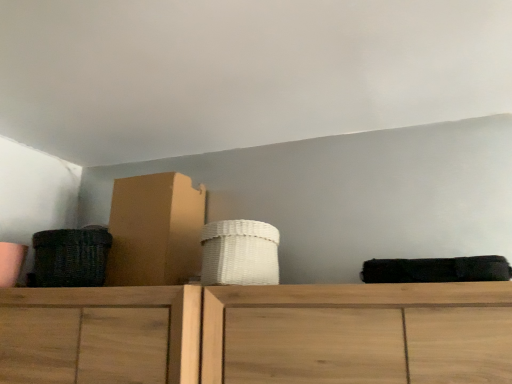
Question: Does white woven basket at center, which is counted as the 2th basket, starting from the left, turn towards dark brown woven basket at left, placed as the second basket when sorted from right to left?

Choices:
 (A) yes
 (B) no

Answer: (B)

Question: Is white woven basket at center, which is counted as the 2th basket, starting from the left, wider than dark brown woven basket at left, which is counted as the 1th basket, starting from the left?

Choices:
 (A) yes
 (B) no

Answer: (A)

Question: Considering the relative positions of white woven basket at center, positioned as the first basket in right-to-left order, and dark brown woven basket at left, placed as the second basket when sorted from right to left, in the image provided, is white woven basket at center, positioned as the first basket in right-to-left order, to the right of dark brown woven basket at left, placed as the second basket when sorted from right to left, from the viewer's perspective?

Choices:
 (A) no
 (B) yes

Answer: (B)

Question: Considering the relative sizes of white woven basket at center, positioned as the first basket in right-to-left order, and dark brown woven basket at left, placed as the second basket when sorted from right to left, in the image provided, is white woven basket at center, positioned as the first basket in right-to-left order, shorter than dark brown woven basket at left, placed as the second basket when sorted from right to left,?

Choices:
 (A) no
 (B) yes

Answer: (A)

Question: Does white woven basket at center, positioned as the first basket in right-to-left order, come behind dark brown woven basket at left, which is counted as the 1th basket, starting from the left?

Choices:
 (A) no
 (B) yes

Answer: (A)

Question: Is point (84, 264) positioned closer to the camera than point (126, 243)?

Choices:
 (A) closer
 (B) farther

Answer: (A)

Question: Looking at their shapes, would you say dark brown woven basket at left, which is counted as the 1th basket, starting from the left, is wider or thinner than cardboard box at left?

Choices:
 (A) thin
 (B) wide

Answer: (A)

Question: From the image's perspective, relative to cardboard box at left, is dark brown woven basket at left, placed as the second basket when sorted from right to left, above or below?

Choices:
 (A) above
 (B) below

Answer: (B)

Question: Relative to cardboard box at left, is dark brown woven basket at left, placed as the second basket when sorted from right to left, in front or behind?

Choices:
 (A) behind
 (B) front

Answer: (B)

Question: In terms of height, does white woven basket at center, which is counted as the 2th basket, starting from the left, look taller or shorter compared to dark brown woven basket at left, which is counted as the 1th basket, starting from the left?

Choices:
 (A) short
 (B) tall

Answer: (B)

Question: Considering the positions of white woven basket at center, which is counted as the 2th basket, starting from the left, and dark brown woven basket at left, placed as the second basket when sorted from right to left, in the image, is white woven basket at center, which is counted as the 2th basket, starting from the left, wider or thinner than dark brown woven basket at left, placed as the second basket when sorted from right to left,?

Choices:
 (A) wide
 (B) thin

Answer: (A)

Question: Based on their sizes in the image, would you say white woven basket at center, positioned as the first basket in right-to-left order, is bigger or smaller than dark brown woven basket at left, placed as the second basket when sorted from right to left?

Choices:
 (A) small
 (B) big

Answer: (B)

Question: From the image's perspective, is white woven basket at center, which is counted as the 2th basket, starting from the left, located above or below dark brown woven basket at left, which is counted as the 1th basket, starting from the left?

Choices:
 (A) below
 (B) above

Answer: (B)

Question: From a real-world perspective, is cardboard box at left physically located above or below dark brown woven basket at left, placed as the second basket when sorted from right to left?

Choices:
 (A) below
 (B) above

Answer: (B)

Question: Is point (202, 225) positioned closer to the camera than point (89, 261)?

Choices:
 (A) farther
 (B) closer

Answer: (A)